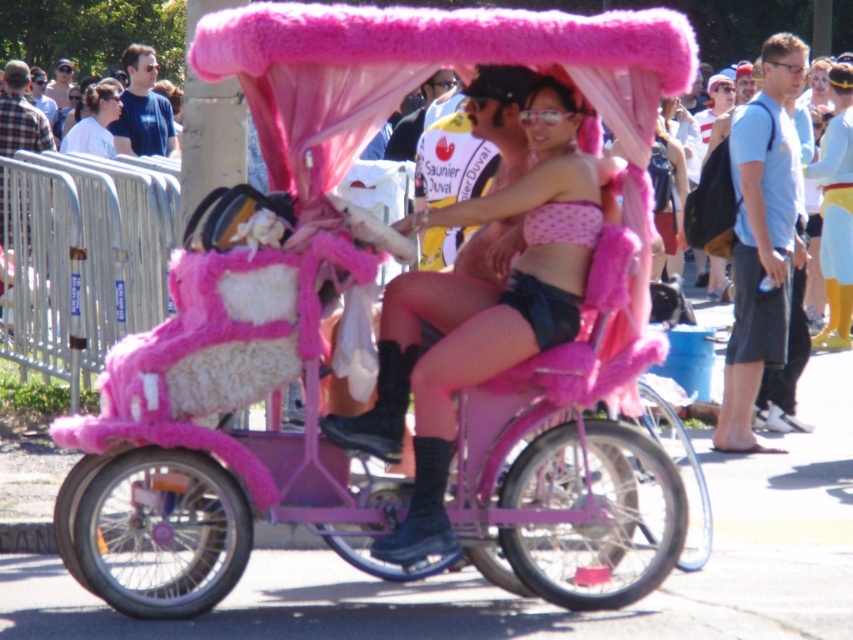
Is matte pink fur coat at center above blue cotton shirt at upper left?

Actually, matte pink fur coat at center is below blue cotton shirt at upper left.

I want to click on matte pink fur coat at center, so click(x=457, y=364).

Is matte pink fur coat at center shorter than blue fabric backpack at right?

Yes.

Is matte pink fur coat at center smaller than blue fabric backpack at right?

No.

Which is behind, point (436, 356) or point (737, 227)?

The point (737, 227) is more distant.

Identify the location of matte pink fur coat at center. (457, 364).

You are a GUI agent. You are given a task and a screenshot of the screen. Output one action in this format:
    pyautogui.click(x=<x>, y=<y>)
    Task: Click on the blue fabric backpack at right
    
    Given the screenshot: What is the action you would take?
    pyautogui.click(x=761, y=237)

Can you confirm if blue fabric backpack at right is shorter than matte white shirt at upper left?

No, blue fabric backpack at right is not shorter than matte white shirt at upper left.

Is point (767, 260) positioned before point (115, 152)?

Yes, point (767, 260) is in front of point (115, 152).

Find the location of `blue fabric backpack at right`. blue fabric backpack at right is located at coordinates (761, 237).